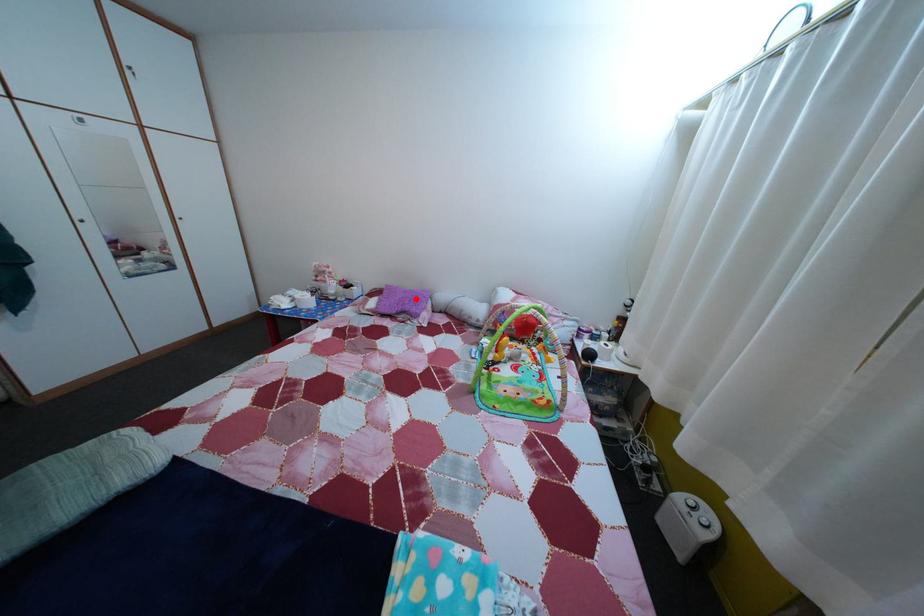
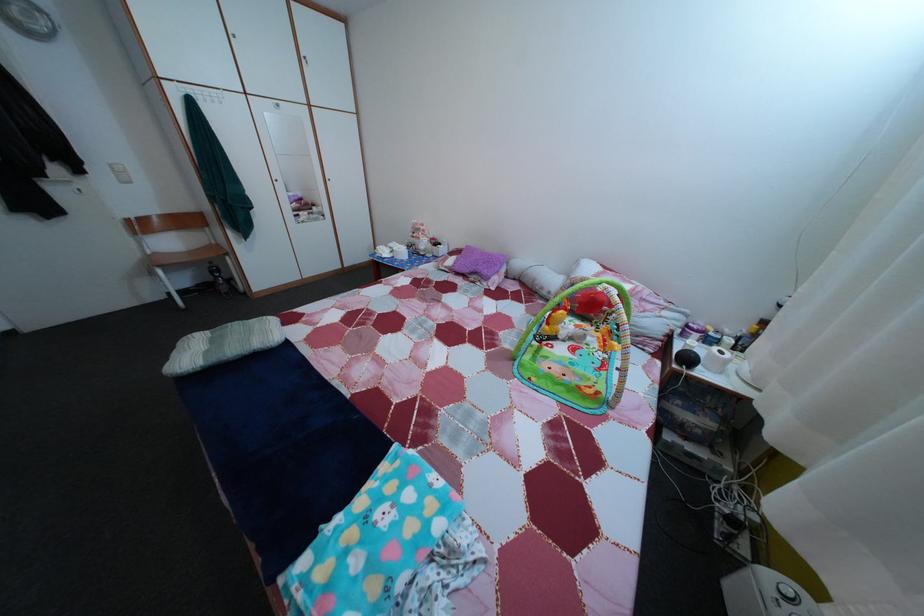
In the second image, find the point that corresponds to the highlighted location in the first image.

(492, 261)